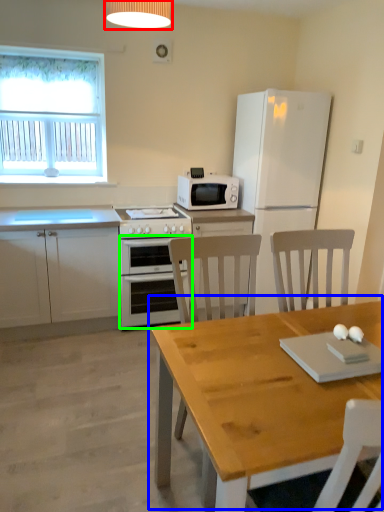
Question: Based on their relative distances, which object is farther from lamp (highlighted by a red box)? Choose from table (highlighted by a blue box) and oven (highlighted by a green box).

Choices:
 (A) table
 (B) oven

Answer: (A)